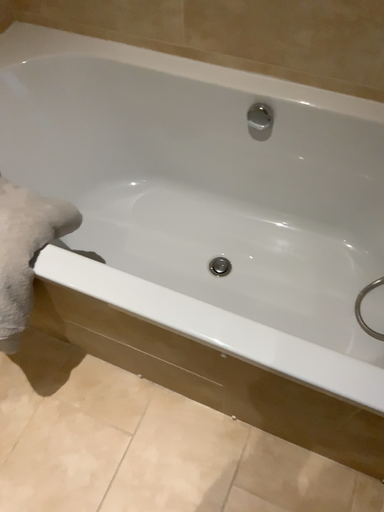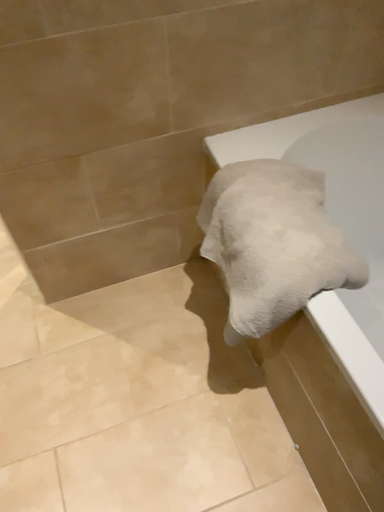
Question: How did the camera likely rotate when shooting the video?

Choices:
 (A) rotated right
 (B) rotated left

Answer: (B)